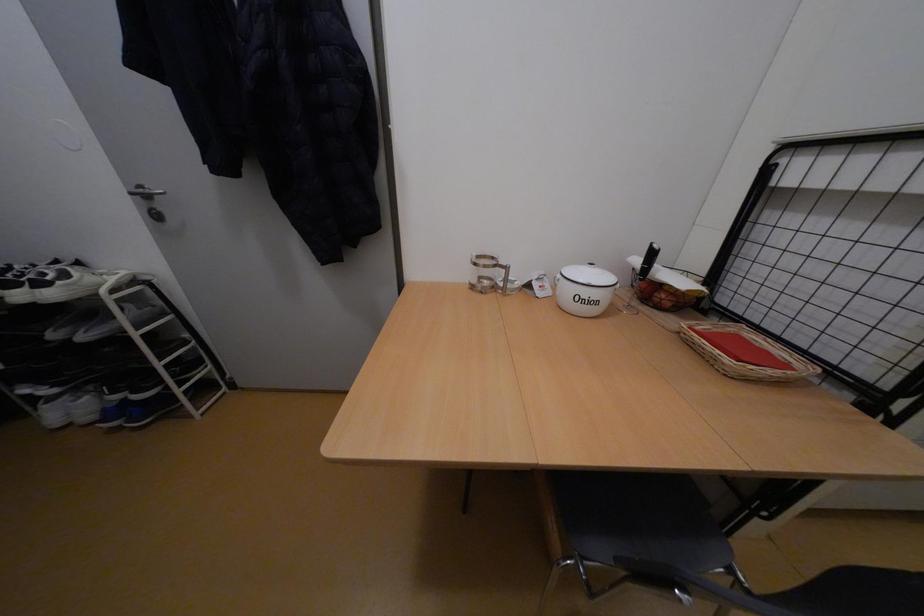
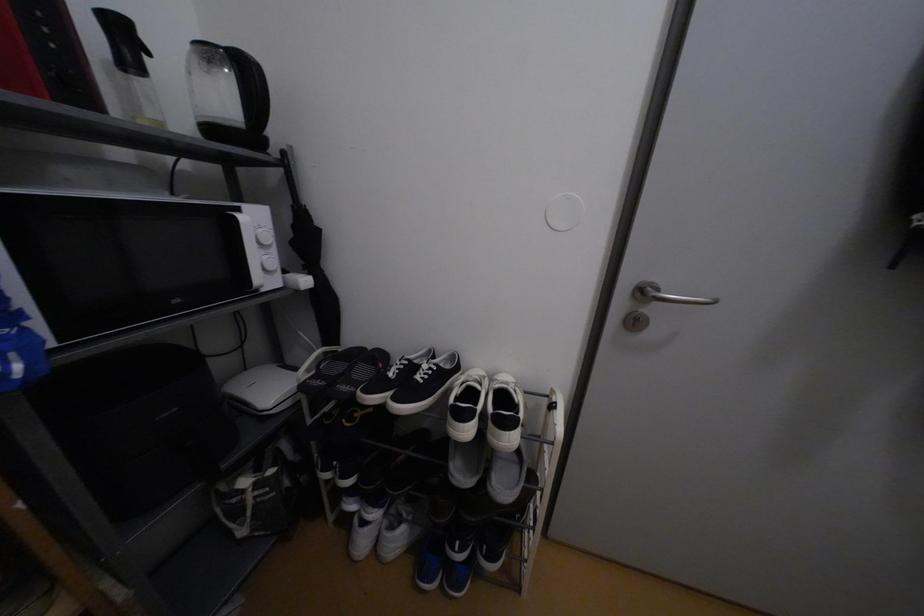
Question: The images are taken continuously from a first-person perspective. In which direction are you moving?

Choices:
 (A) Left
 (B) Right
 (C) Forward
 (D) Backward

Answer: (A)